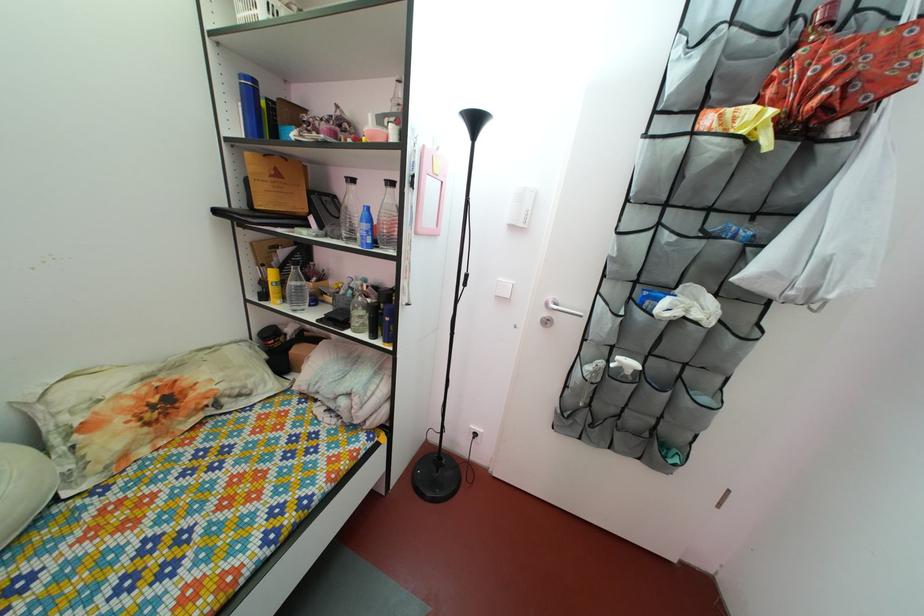
Find the location of a particular element. This screenshot has height=616, width=924. silver door handle is located at coordinates (565, 313).